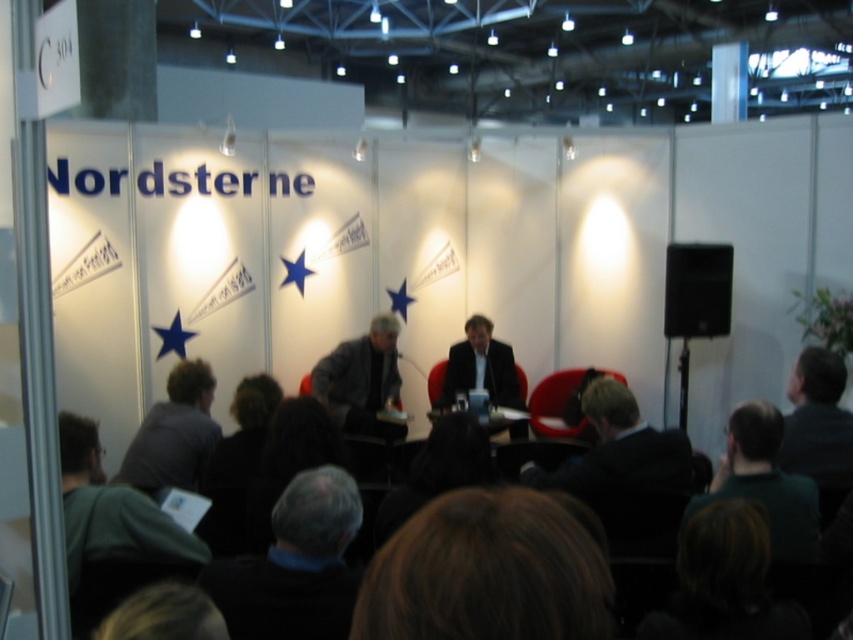
Question: In this image, where is gray fabric jacket at center located relative to black plastic speaker at right?

Choices:
 (A) right
 (B) left

Answer: (B)

Question: Which of the following is the farthest from the observer?

Choices:
 (A) dark green shirt at lower right
 (B) gray fabric jacket at center
 (C) dark gray sweater at lower center

Answer: (B)

Question: Which of these objects is positioned farthest from the dark gray suit at lower right?

Choices:
 (A) dark gray shirt at lower left
 (B) brown hair at center
 (C) dark green shirt at lower right

Answer: (B)

Question: Considering the real-world distances, which object is closest to the matte black suit at center?

Choices:
 (A) dark green shirt at lower right
 (B) black plastic speaker at right

Answer: (B)

Question: Can you confirm if dark green shirt at lower right is smaller than gray fabric jacket at center?

Choices:
 (A) no
 (B) yes

Answer: (B)

Question: Is gray fabric jacket at center to the left of matte black suit at center from the viewer's perspective?

Choices:
 (A) yes
 (B) no

Answer: (A)